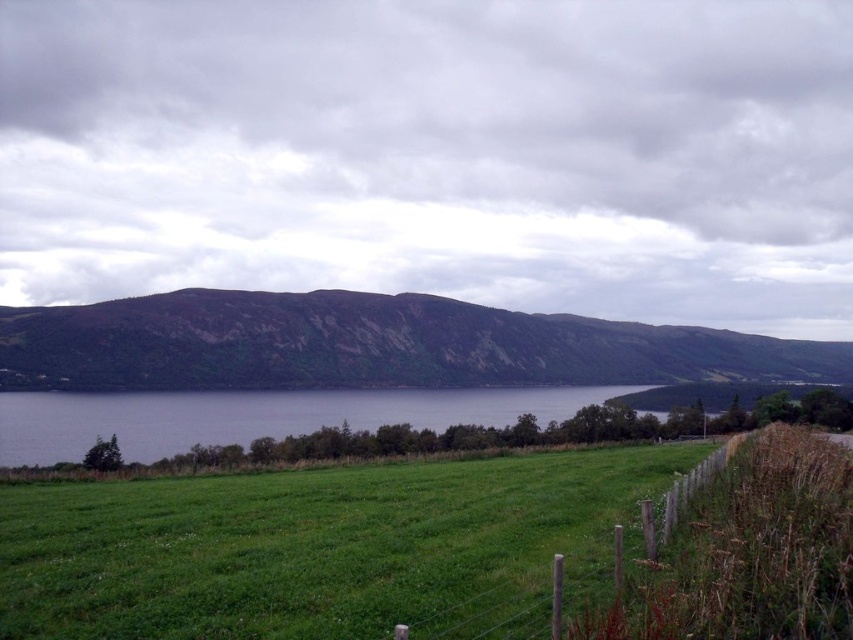
Looking at this image, you are standing at the origin point in the image and want to walk towards the two points labeled as point [228,378] and point [233,435]. Which point will you encounter first?

You will encounter point [233,435] first because it is closer to you than point [228,378], which is further away.

You are standing at the edge of the green grassy field at lower center and want to walk towards the wooden fence on the right. Which direction should you head to avoid crossing the green grassy field at center?

You should head to the left to avoid crossing the green grassy field at center, as it is positioned on the right side of the green grassy field at lower center.

You are standing at the edge of the green grassy field at lower center and want to climb the brown rocky mountain at center. Considering their sizes, will you need to exert more effort compared to climbing a hill of average size?

The brown rocky mountain at center is much taller than the green grassy field at lower center, so yes, you will need to exert more effort than climbing a hill of average size.